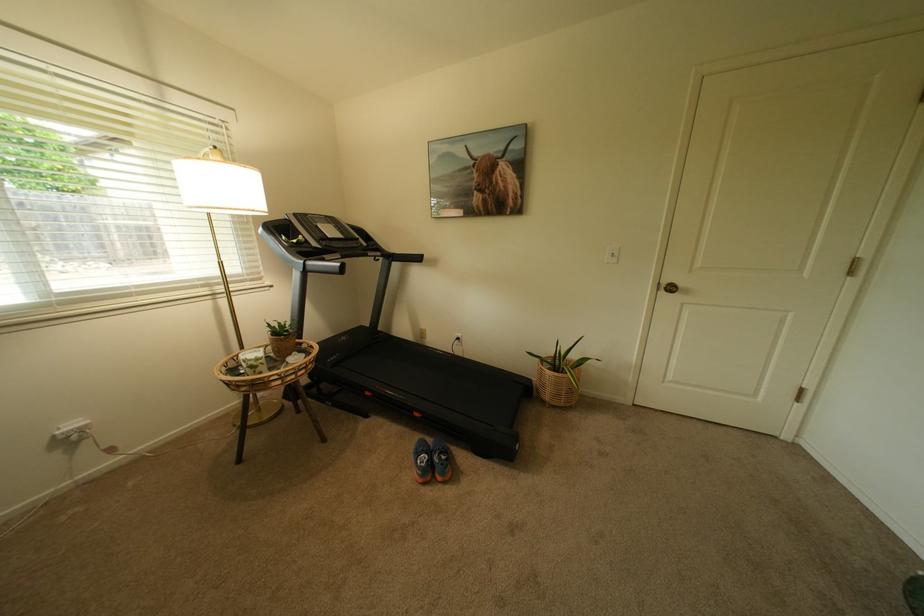
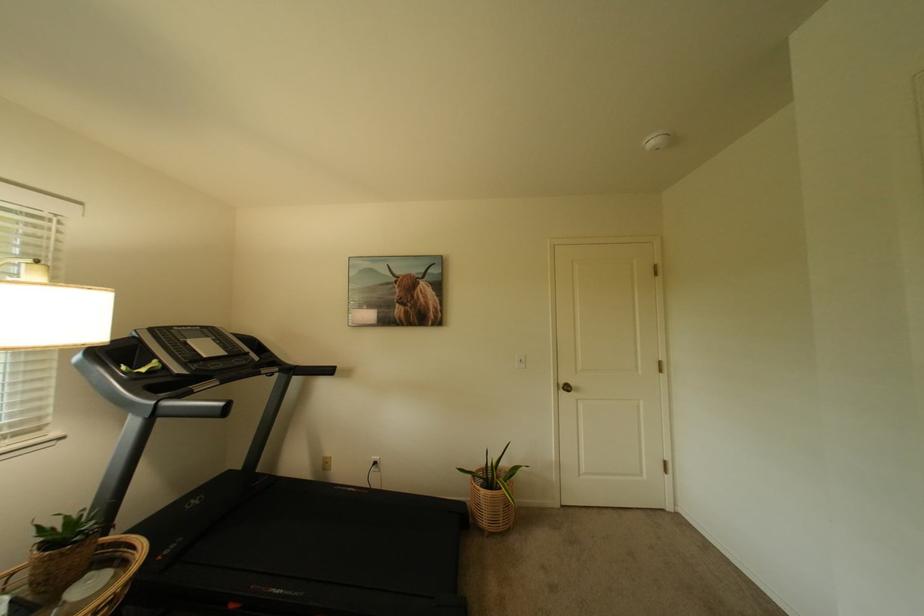
Question: The images are taken continuously from a first-person perspective. In which direction are you moving?

Choices:
 (A) Left
 (B) Right
 (C) Forward
 (D) Backward

Answer: (A)